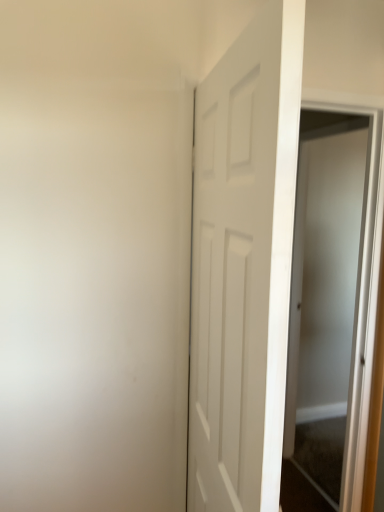
Question: Is clear glass screen door at right taller or shorter than white matte door at center?

Choices:
 (A) tall
 (B) short

Answer: (A)

Question: From the image's perspective, is clear glass screen door at right located above or below white matte door at center?

Choices:
 (A) above
 (B) below

Answer: (B)

Question: Is clear glass screen door at right wider or thinner than white matte door at center?

Choices:
 (A) wide
 (B) thin

Answer: (B)

Question: Which is correct: white matte door at center is inside clear glass screen door at right, or outside of it?

Choices:
 (A) inside
 (B) outside

Answer: (B)

Question: Considering the positions of white matte door at center and clear glass screen door at right in the image, is white matte door at center wider or thinner than clear glass screen door at right?

Choices:
 (A) wide
 (B) thin

Answer: (A)

Question: Looking at the image, does white matte door at center seem bigger or smaller compared to clear glass screen door at right?

Choices:
 (A) big
 (B) small

Answer: (A)

Question: Is point (241, 493) closer or farther from the camera than point (355, 408)?

Choices:
 (A) closer
 (B) farther

Answer: (A)